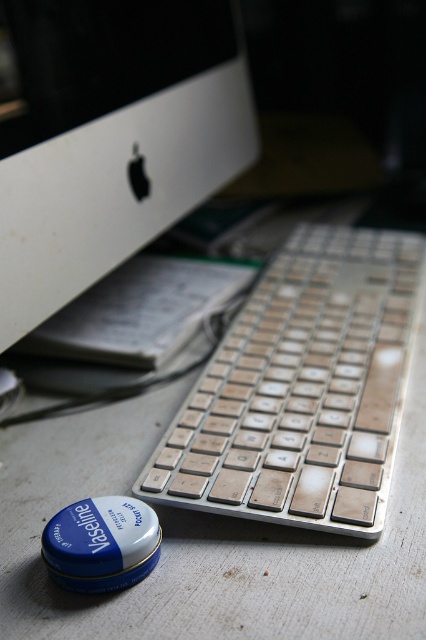
You are setting up a new monitor stand that requires knowing which object is taller between the white matte computer monitor at upper left and the silver metallic keyboard at center. Based on the scene, which one is taller?

The white matte computer monitor at upper left is taller than the silver metallic keyboard at center according to the description.

You are a delivery person who just arrived at the office to deliver a new keyboard. The new keyboard is 12 inches long. You need to place it on the desk so that it doesn not block the view of the monitor. Based on the current setup, will the new keyboard fit between the white matte computer monitor at upper left and the existing silver metallic keyboard at center without blocking the monitor?

The distance between the white matte computer monitor at upper left and the silver metallic keyboard at center is 11.10 inches. Since the new keyboard is 12 inches long, it would not fit in the space between them without overlapping, which could block the monitor.

You are organizing your desk and want to move the silver metallic keyboard at center closer to the white matte computer monitor at upper left. Based on their current positions, which direction should you move the keyboard to align it with the monitor?

The white matte computer monitor at upper left is positioned on the left side of the silver metallic keyboard at center, so you should move the keyboard to the left to align it with the monitor.